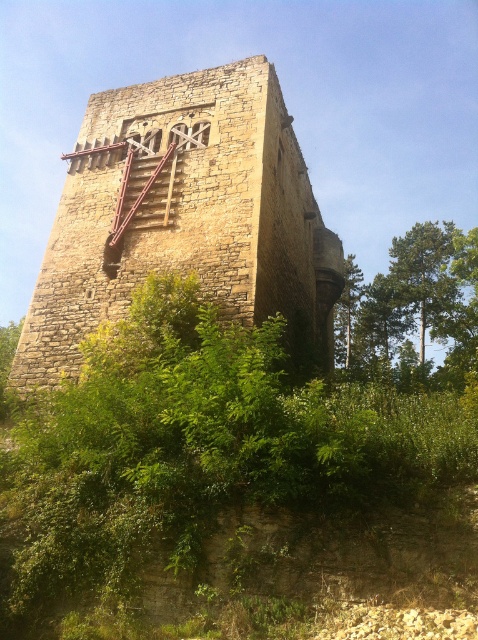
Can you confirm if stone tower at center is positioned to the left of green leafy tree at center?

Yes, stone tower at center is to the left of green leafy tree at center.

Based on the photo, is stone tower at center smaller than green leafy tree at center?

No.

Does point (290, 243) lie behind point (335, 326)?

No, it is in front of (335, 326).

Locate an element on the screen. The image size is (478, 640). stone tower at center is located at coordinates (184, 216).

Who is shorter, green leafy bush at center or green leafy tree at center?

With less height is green leafy bush at center.

Is point (109, 403) more distant than point (347, 272)?

No, (109, 403) is in front of (347, 272).

Which is in front, point (156, 369) or point (361, 284)?

Point (156, 369) is in front.

The width and height of the screenshot is (478, 640). I want to click on green leafy bush at center, so click(227, 488).

Is stone tower at center shorter than green leafy tree at right?

Correct, stone tower at center is not as tall as green leafy tree at right.

Is stone tower at center taller than green leafy tree at right?

No, stone tower at center is not taller than green leafy tree at right.

This screenshot has height=640, width=478. What are the coordinates of `stone tower at center` in the screenshot? It's located at (184, 216).

Find the location of `stone tower at center`. stone tower at center is located at coordinates (184, 216).